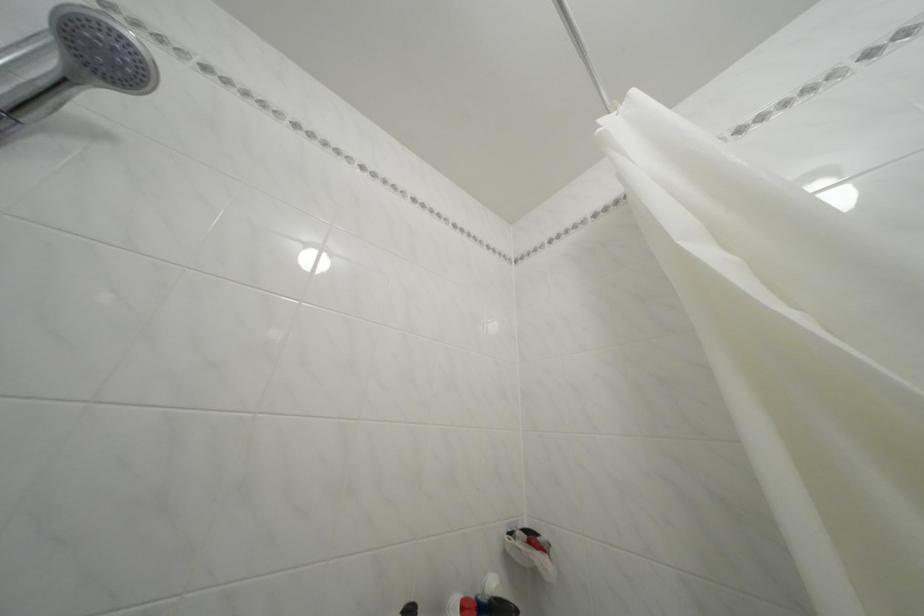
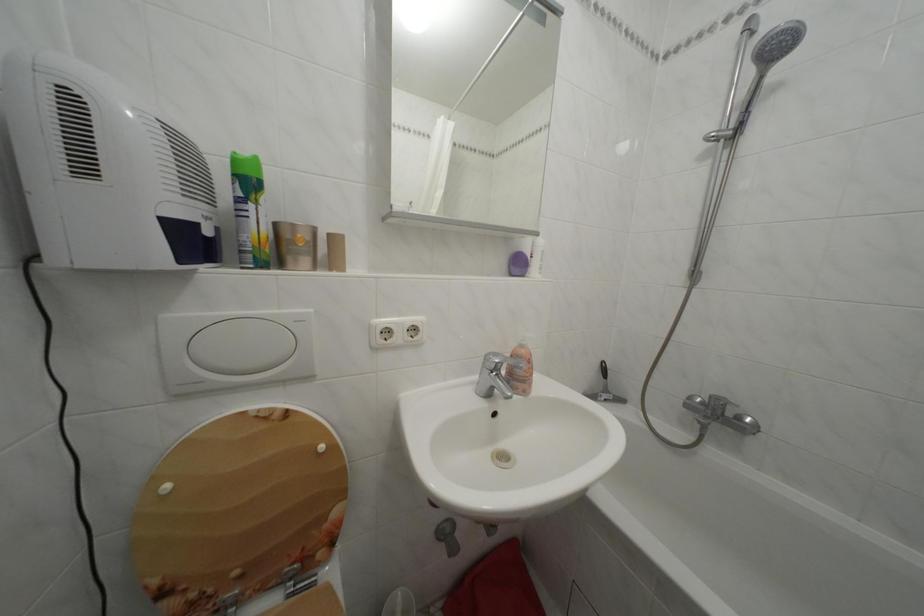
Question: The images are taken continuously from a first-person perspective. In which direction is your viewpoint rotating?

Choices:
 (A) Left
 (B) Right
 (C) Up
 (D) Down

Answer: (A)